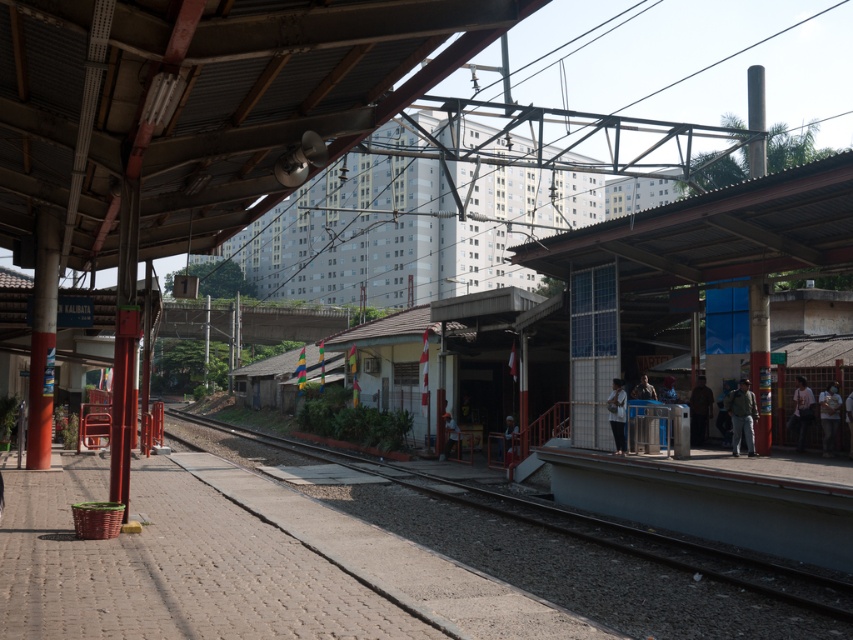
Question: Which object is closer to the camera taking this photo?

Choices:
 (A) light brown fabric shirt at right
 (B) light brown wooden pole at right

Answer: (B)

Question: Which object is closer to the camera taking this photo?

Choices:
 (A) light brown leather jacket at right
 (B) white fabric bag at lower center
 (C) brown gravel track at center
 (D) dark brown jacket at right

Answer: (C)

Question: Can you confirm if dark brown jacket at right is positioned above light brown wooden chair at center?

Choices:
 (A) yes
 (B) no

Answer: (A)

Question: Is the position of orange fabric hat at center less distant than that of light brown wooden chair at center?

Choices:
 (A) no
 (B) yes

Answer: (A)

Question: Which point is closer to the camera?

Choices:
 (A) white fabric bag at lower center
 (B) light brown wooden pole at right
 (C) matte red helmet at center
 (D) light brown wooden chair at center

Answer: (B)

Question: Can you confirm if light brown leather jacket at right is wider than dark brown leather jacket at right?

Choices:
 (A) yes
 (B) no

Answer: (A)